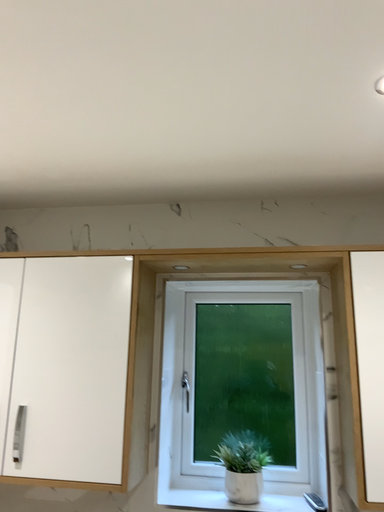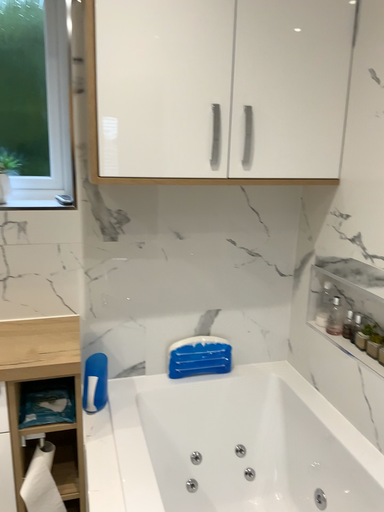
Question: Which way did the camera rotate in the video?

Choices:
 (A) rotated upward
 (B) rotated downward

Answer: (B)